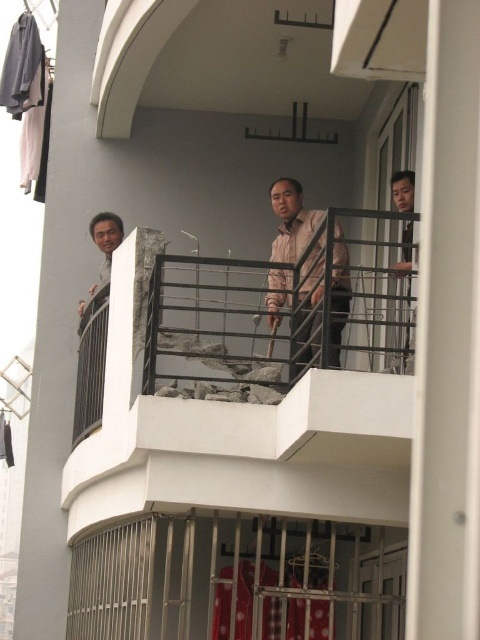
You are a delivery person trying to place a package on the balcony. The pink matte shirt at center and the matte black shirt at upper right are in the way. Which person should you ask to move to create more space?

The pink matte shirt at center has a larger width than the matte black shirt at upper right, so you should ask the pink matte shirt at center to move to create more space.

You are a construction worker on the balcony. You need to move the pink matte shirt at center and the matte black shirt at upper right to a safe location. Which shirt should you move first if you want to carry the larger one first?

The pink matte shirt at center is bigger than the matte black shirt at upper right, so you should move the pink matte shirt at center first.